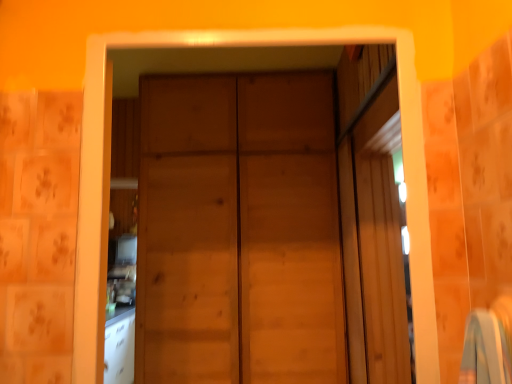
Describe the element at coordinates (239, 231) in the screenshot. I see `natural wood barn door at center` at that location.

I want to click on natural wood barn door at center, so click(x=239, y=231).

What is the approximate height of natural wood barn door at center?

It is 6.22 feet.

The height and width of the screenshot is (384, 512). I want to click on natural wood barn door at center, so click(239, 231).